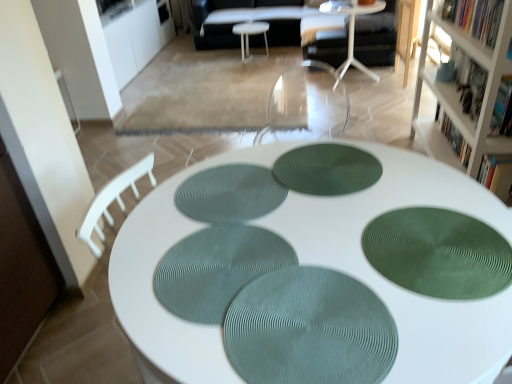
Question: From a real-world perspective, is green matte bookshelf at upper right, marked as the second book in a front-to-back arrangement, located beneath white textured table at center, which is the 1th table from front to back?

Choices:
 (A) no
 (B) yes

Answer: (A)

Question: Is green matte bookshelf at upper right, marked as the second book in a front-to-back arrangement, closer to camera compared to white textured table at center, marked as the third table in a top-to-bottom arrangement?

Choices:
 (A) no
 (B) yes

Answer: (A)

Question: Does green matte bookshelf at upper right, marked as the second book in a front-to-back arrangement, have a larger size compared to white textured table at center, arranged as the first table when ordered from the bottom?

Choices:
 (A) no
 (B) yes

Answer: (A)

Question: From a real-world perspective, is green matte bookshelf at upper right, marked as the second book in a front-to-back arrangement, on white textured table at center, which is the 1th table from front to back?

Choices:
 (A) no
 (B) yes

Answer: (B)

Question: Is green matte bookshelf at upper right, the 2th book when ordered from back to front, at the right side of white textured table at center, which is the 1th table from front to back?

Choices:
 (A) yes
 (B) no

Answer: (A)

Question: From the image's perspective, is hardcover book at upper right, placed as the 1th book when sorted from back to front, located above or below hardcover book at upper right, which is the 3th book in back-to-front order?

Choices:
 (A) below
 (B) above

Answer: (B)

Question: Looking at their shapes, would you say hardcover book at upper right, placed as the 1th book when sorted from back to front, is wider or thinner than hardcover book at upper right, which is the 1th book from front to back?

Choices:
 (A) wide
 (B) thin

Answer: (B)

Question: In the image, is hardcover book at upper right, arranged as the third book when viewed from the front, positioned in front of or behind hardcover book at upper right, which is the 1th book from front to back?

Choices:
 (A) front
 (B) behind

Answer: (B)

Question: From a real-world perspective, is hardcover book at upper right, placed as the 1th book when sorted from back to front, above or below hardcover book at upper right, which is the 1th book from front to back?

Choices:
 (A) below
 (B) above

Answer: (A)

Question: Is green textured placemat at center, marked as the 3th mat in a left-to-right arrangement, in front of or behind white fabric couch at center in the image?

Choices:
 (A) behind
 (B) front

Answer: (B)

Question: From the image's perspective, is green textured placemat at center, marked as the 3th mat in a left-to-right arrangement, positioned above or below white fabric couch at center?

Choices:
 (A) below
 (B) above

Answer: (A)

Question: Visually, is green textured placemat at center, the 2th mat viewed from the right, positioned to the left or to the right of white fabric couch at center?

Choices:
 (A) left
 (B) right

Answer: (B)

Question: Is green textured placemat at center, the 2th mat viewed from the right, spatially inside white fabric couch at center, or outside of it?

Choices:
 (A) outside
 (B) inside

Answer: (A)

Question: In terms of width, does hardcover book at upper right, which is the 3th book in back-to-front order, look wider or thinner when compared to white fabric couch at center?

Choices:
 (A) wide
 (B) thin

Answer: (B)

Question: From a real-world perspective, is hardcover book at upper right, which is the 3th book in back-to-front order, above or below white fabric couch at center?

Choices:
 (A) below
 (B) above

Answer: (B)